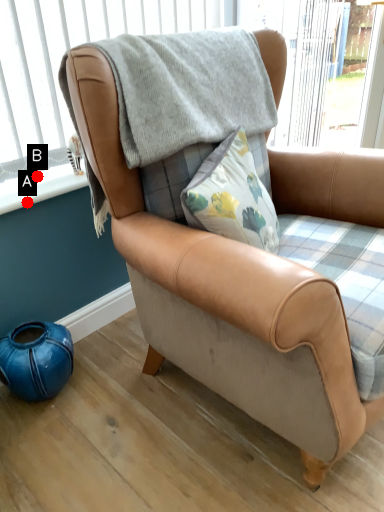
Question: Two points are circled on the image, labeled by A and B beside each circle. Which of the following is the farthest from the observer?

Choices:
 (A) A is further
 (B) B is further

Answer: (B)